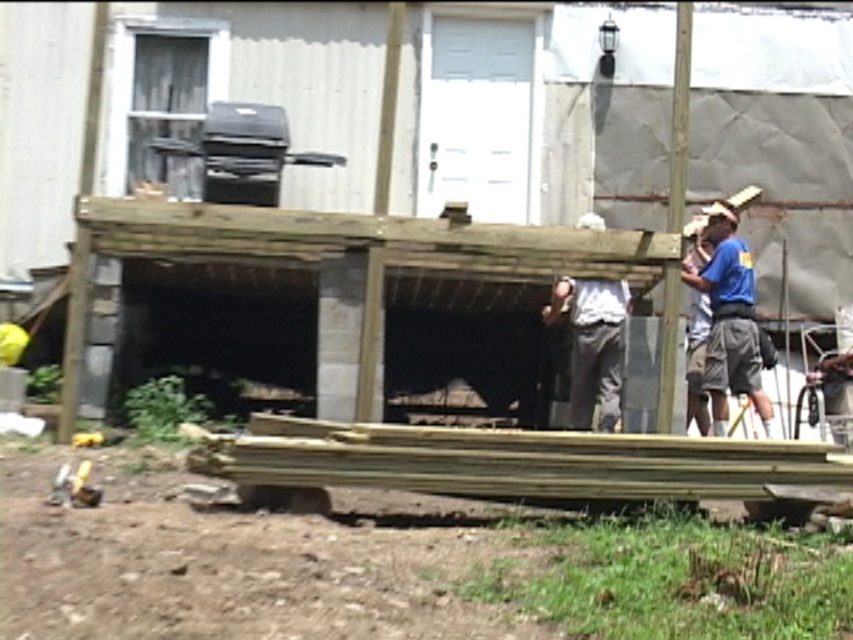
Who is more distant from viewer, (703,289) or (602,340)?

The point (703,289) is more distant.

Which is in front, point (746, 371) or point (573, 422)?

Point (746, 371)

Identify the location of blue fabric shirt at right. This screenshot has height=640, width=853. pos(729,317).